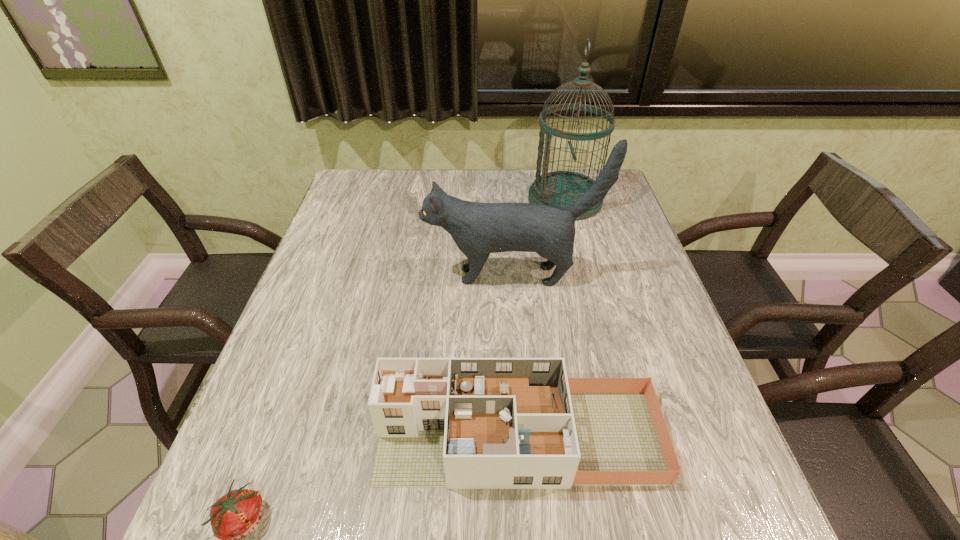
Identify the location of vacant space at the far edge of the desktop. The height and width of the screenshot is (540, 960). (447, 179).

At what (x,y) coordinates should I click in order to perform the action: click on vacant space at the near edge of the desktop. Please return your answer as a coordinate pair (x, y). This screenshot has width=960, height=540. Looking at the image, I should click on (385, 506).

Find the location of a particular element. free region at the left edge is located at coordinates (336, 218).

Identify the location of free region at the right edge. (636, 265).

The width and height of the screenshot is (960, 540). Identify the location of vacant region at the far left corner of the desktop. (362, 192).

Locate an element on the screen. vacant region at the far right corner of the desktop is located at coordinates (621, 205).

This screenshot has width=960, height=540. What are the coordinates of `free space between the birdcage and the third tallest object` in the screenshot? It's located at (541, 318).

This screenshot has width=960, height=540. What are the coordinates of `free area in between the second nearest object and the birdcage` in the screenshot? It's located at (541, 318).

You are a GUI agent. You are given a task and a screenshot of the screen. Output one action in this format:
    pyautogui.click(x=<x>, y=<y>)
    Task: Click on the second closest object relative to the tomato
    This screenshot has height=540, width=960.
    Given the screenshot: What is the action you would take?
    pyautogui.click(x=478, y=229)

Locate an element on the screen. This screenshot has height=540, width=960. object that ranks as the second closest to the third nearest object is located at coordinates (459, 423).